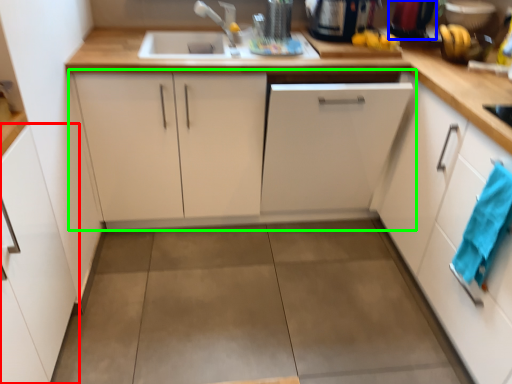
Question: Which object is positioned closest to cabinetry (highlighted by a red box)? Select from appliance (highlighted by a blue box) and cabinetry (highlighted by a green box).

Choices:
 (A) appliance
 (B) cabinetry

Answer: (B)